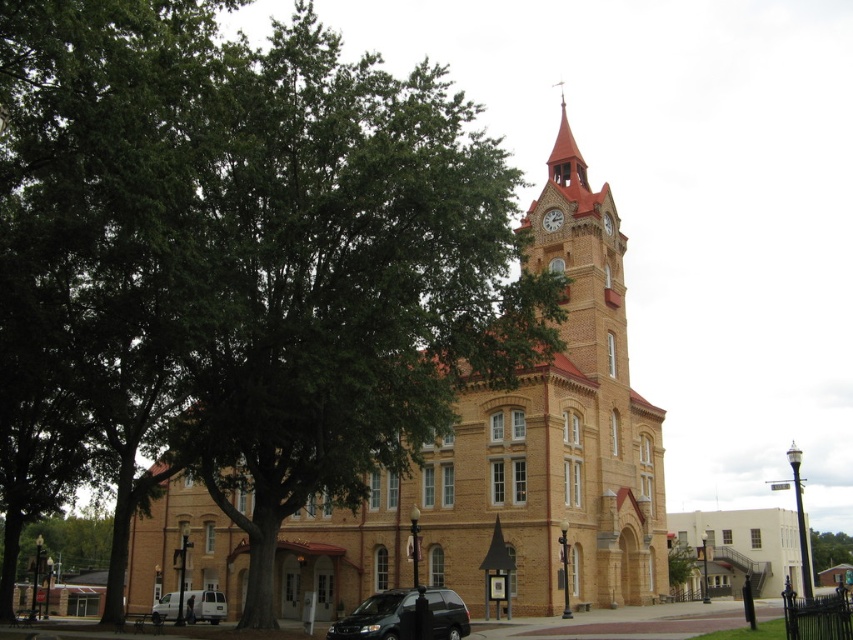
You are standing in front of the historic building and want to determine the relative positions of two points marked on the structure. The first point is at coordinate point(561, 259) and the second is at point(549, 225). Which point is nearer to you?

Point(561, 259) is closer to the viewer than point(549, 225).